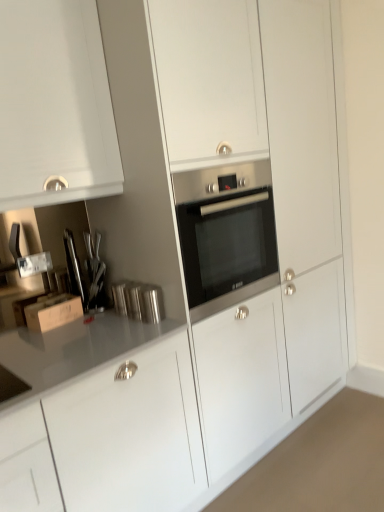
The width and height of the screenshot is (384, 512). What do you see at coordinates (53, 312) in the screenshot? I see `cardboard box at left` at bounding box center [53, 312].

In order to click on cardboard box at left in this screenshot , I will do `click(53, 312)`.

Measure the distance between stainless steel oven at center and camera.

stainless steel oven at center and camera are 5.13 feet apart from each other.

At what (x,y) coordinates should I click in order to perform the action: click on stainless steel oven at center. Please return your answer as a coordinate pair (x, y). This screenshot has height=512, width=384. Looking at the image, I should click on (226, 236).

The width and height of the screenshot is (384, 512). Describe the element at coordinates (226, 236) in the screenshot. I see `stainless steel oven at center` at that location.

At what (x,y) coordinates should I click in order to perform the action: click on cardboard box at left. Please return your answer as a coordinate pair (x, y). Looking at the image, I should click on (53, 312).

Which object is positioned more to the left, stainless steel oven at center or cardboard box at left?

cardboard box at left is more to the left.

Which object is further away from the camera taking this photo, stainless steel oven at center or cardboard box at left?

Positioned behind is cardboard box at left.

Considering the points (250, 265) and (53, 319), which point is in front, point (250, 265) or point (53, 319)?

The point (53, 319) is more forward.

From the image's perspective, is stainless steel oven at center under cardboard box at left?

No.

From a real-world perspective, is stainless steel oven at center on cardboard box at left?

Indeed, from a real-world perspective, stainless steel oven at center stands above cardboard box at left.

Looking at their sizes, would you say stainless steel oven at center is wider or thinner than cardboard box at left?

stainless steel oven at center is wider than cardboard box at left.

Between stainless steel oven at center and cardboard box at left, which one has more height?

stainless steel oven at center is taller.

From the picture: Between stainless steel oven at center and cardboard box at left, which one has smaller size?

cardboard box at left is smaller.

From the picture: Is cardboard box at left surrounded by stainless steel oven at center?

No.

Is stainless steel oven at center in contact with cardboard box at left?

No.

Is stainless steel oven at center positioned with its back to cardboard box at left?

stainless steel oven at center is not turned away from cardboard box at left.

What's the angular difference between stainless steel oven at center and cardboard box at left's facing directions?

They differ by 0.000543 degrees in their facing directions.

This screenshot has width=384, height=512. I want to click on cardboard box on the left of stainless steel oven at center, so click(53, 312).

Considering the positions of objects cardboard box at left and stainless steel oven at center in the image provided, who is more to the right, cardboard box at left or stainless steel oven at center?

stainless steel oven at center.

Does cardboard box at left lie behind stainless steel oven at center?

Yes, it is.

Does point (66, 310) lie behind point (227, 184)?

Yes.

From the image's perspective, is cardboard box at left above or below stainless steel oven at center?

From the image's perspective, cardboard box at left appears below stainless steel oven at center.

Consider the image. From a real-world perspective, is cardboard box at left positioned over stainless steel oven at center based on gravity?

No, from a real-world perspective, cardboard box at left is not above stainless steel oven at center.

Looking at this image, in terms of width, does cardboard box at left look wider or thinner when compared to stainless steel oven at center?

In the image, cardboard box at left appears to be more narrow than stainless steel oven at center.

Does cardboard box at left have a greater height compared to stainless steel oven at center?

Incorrect, the height of cardboard box at left is not larger of that of stainless steel oven at center.

Considering the relative sizes of cardboard box at left and stainless steel oven at center in the image provided, is cardboard box at left bigger than stainless steel oven at center?

No.

Can stainless steel oven at center be found inside cardboard box at left?

No, stainless steel oven at center is not surrounded by cardboard box at left.

Would you consider cardboard box at left to be distant from stainless steel oven at center?

No, cardboard box at left is in close proximity to stainless steel oven at center.

Could you tell me if cardboard box at left is facing stainless steel oven at center?

No, cardboard box at left is not oriented towards stainless steel oven at center.

Locate an element on the screen. This screenshot has width=384, height=512. home appliance that appears on the right of cardboard box at left is located at coordinates (226, 236).

Find the location of a particular element. The image size is (384, 512). cardboard box on the left side of stainless steel oven at center is located at coordinates pyautogui.click(x=53, y=312).

The image size is (384, 512). Identify the location of cardboard box beneath the stainless steel oven at center (from a real-world perspective). (53, 312).